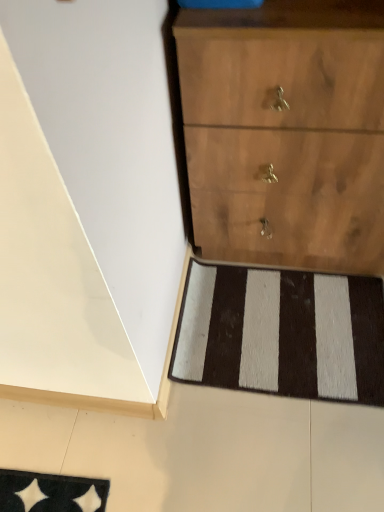
Question: Is wooden chest of drawers at center in front of black/white striped rug at lower center?

Choices:
 (A) yes
 (B) no

Answer: (A)

Question: Are wooden chest of drawers at center and black/white striped rug at lower center beside each other?

Choices:
 (A) yes
 (B) no

Answer: (B)

Question: From a real-world perspective, does wooden chest of drawers at center sit lower than black/white striped rug at lower center?

Choices:
 (A) no
 (B) yes

Answer: (A)

Question: Does wooden chest of drawers at center appear on the left side of black/white striped rug at lower center?

Choices:
 (A) no
 (B) yes

Answer: (A)

Question: Is wooden chest of drawers at center taller than black/white striped rug at lower center?

Choices:
 (A) yes
 (B) no

Answer: (A)

Question: From a real-world perspective, is wooden chest of drawers at center over black/white striped rug at lower center?

Choices:
 (A) yes
 (B) no

Answer: (A)

Question: Is black/white striped rug at lower center in front of wooden chest of drawers at center?

Choices:
 (A) yes
 (B) no

Answer: (B)

Question: Considering the relative sizes of black/white striped rug at lower center and wooden chest of drawers at center in the image provided, is black/white striped rug at lower center wider than wooden chest of drawers at center?

Choices:
 (A) no
 (B) yes

Answer: (B)

Question: Is black/white striped rug at lower center outside of wooden chest of drawers at center?

Choices:
 (A) no
 (B) yes

Answer: (B)

Question: From a real-world perspective, does black/white striped rug at lower center sit lower than wooden chest of drawers at center?

Choices:
 (A) yes
 (B) no

Answer: (A)

Question: Does black/white striped rug at lower center lie behind wooden chest of drawers at center?

Choices:
 (A) no
 (B) yes

Answer: (B)

Question: Is black/white striped rug at lower center aimed at wooden chest of drawers at center?

Choices:
 (A) no
 (B) yes

Answer: (A)

Question: Is wooden chest of drawers at center taller or shorter than black/white striped rug at lower center?

Choices:
 (A) short
 (B) tall

Answer: (B)